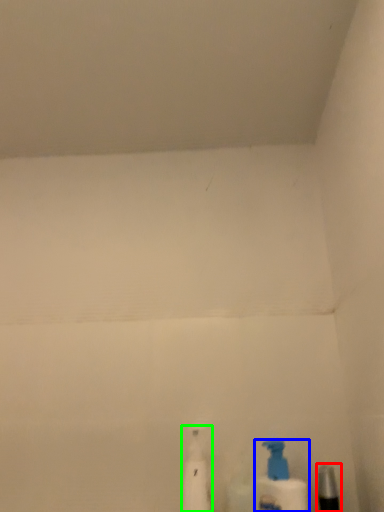
Question: Considering the real-world distances, which object is closest to toiletry (highlighted by a red box)? bottle (highlighted by a blue box) or cleaning product (highlighted by a green box).

Choices:
 (A) bottle
 (B) cleaning product

Answer: (A)